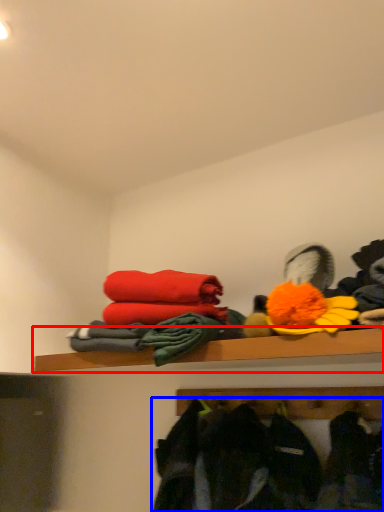
Question: Which object is further to the camera taking this photo, shelf (highlighted by a red box) or clothing (highlighted by a blue box)?

Choices:
 (A) shelf
 (B) clothing

Answer: (A)